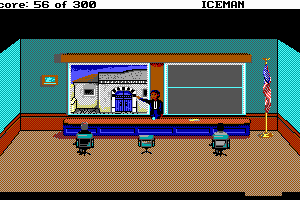
Identify the location of chairs. This screenshot has height=200, width=300. 86,140, 136,145, 224,145.